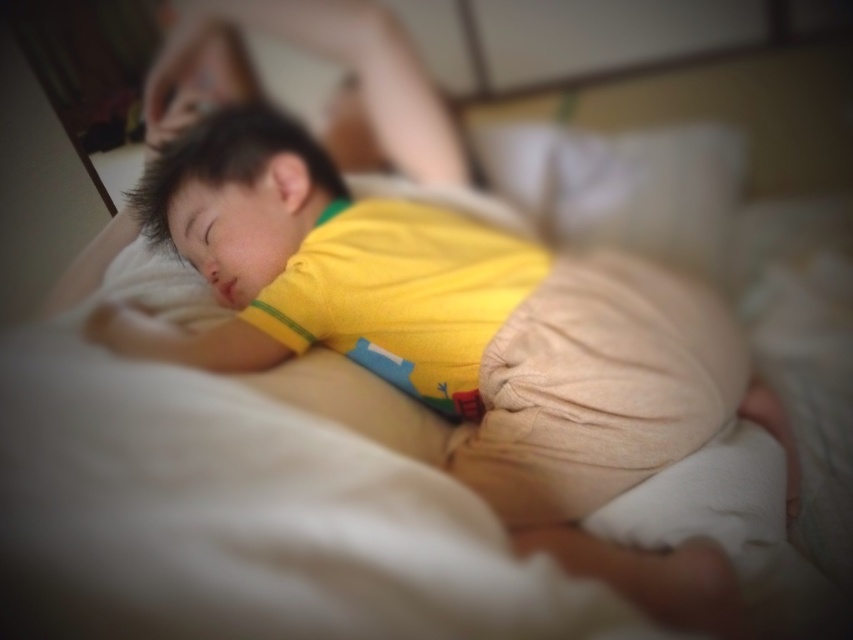
You are a photographer setting up a shot of the child in the scene. You want to ensure that the yellow cotton shirt at center and beige soft pillow at upper center are both visible in the frame. Given their sizes, which object should you prioritize keeping in focus to ensure it takes up more space in the photo?

The yellow cotton shirt at center has a greater height compared to the beige soft pillow at upper center, so you should prioritize keeping the yellow cotton shirt at center in focus to ensure it takes up more space in the photo.

You are a photographer setting up a shoot in the bedroom. You need to ensure that the yellow cotton shirt at center and the beige soft pillow at upper center are both visible in the frame. Given their sizes, which object should you position closer to the camera to maintain their visibility without cropping?

The yellow cotton shirt at center is larger than the beige soft pillow at upper center. To maintain visibility without cropping, position the beige soft pillow at upper center closer to the camera since it is smaller and needs to be more prominent in the frame.